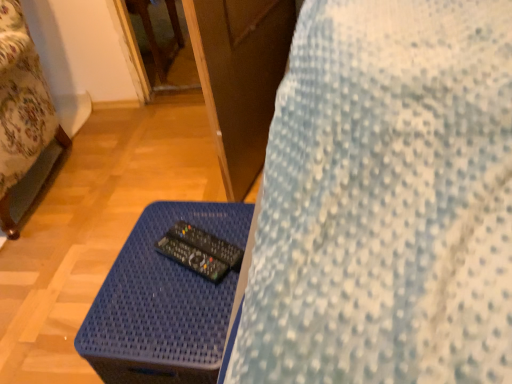
This screenshot has width=512, height=384. In order to click on vacant space situated above blue woven table at lower center (from a real-world perspective) in this screenshot , I will do `click(164, 265)`.